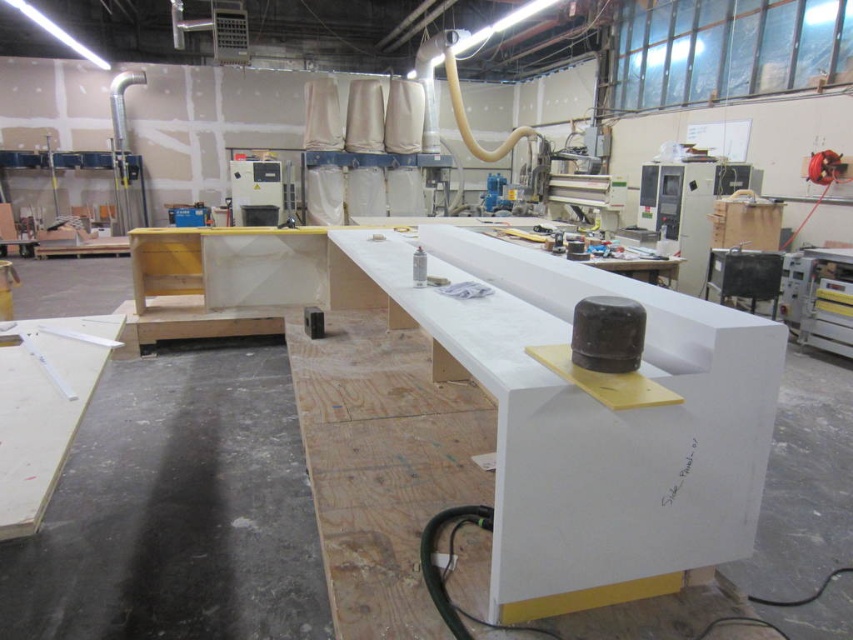
You are standing in the workshop and need to place a new tool on the white matte table at center. According to the image, where exactly should you place it?

The white matte table at center is located at point (595,420), so you should place the new tool there.

You are standing in the workshop and want to move from the point at the bottom of the image to the point at the top. Which direction should you move relative to the two points labeled as point (527,388) and point (93,356)?

To move from the point at the bottom to the top, you should move towards point (527,388) since it is in front of point (93,356).